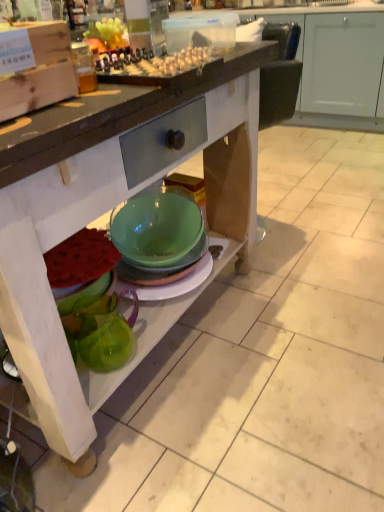
This screenshot has width=384, height=512. What do you see at coordinates (101, 332) in the screenshot?
I see `green glass pitcher at lower left` at bounding box center [101, 332].

What do you see at coordinates (112, 208) in the screenshot? The image size is (384, 512). I see `green glass bowl at lower center` at bounding box center [112, 208].

Where is `green glass bowl at lower center`? The width and height of the screenshot is (384, 512). green glass bowl at lower center is located at coordinates (112, 208).

Describe the element at coordinates (157, 64) in the screenshot. The image size is (384, 512). I see `translucent plastic container at upper center` at that location.

This screenshot has width=384, height=512. I want to click on green glass pitcher at lower left, so click(101, 332).

Considering the sizes of objects green glass pitcher at lower left and translucent plastic container at upper center in the image provided, who is bigger, green glass pitcher at lower left or translucent plastic container at upper center?

translucent plastic container at upper center.

Is point (115, 348) closer or farther from the camera than point (197, 55)?

Point (115, 348) appears to be farther away from the viewer than point (197, 55).

Is green glass pitcher at lower left positioned behind translucent plastic container at upper center?

Yes, green glass pitcher at lower left is behind translucent plastic container at upper center.

Is green glass bowl at lower center facing away from matte wood cabinet at upper center?

Yes, green glass bowl at lower center's orientation is away from matte wood cabinet at upper center.

From the image's perspective, between green glass bowl at lower center and matte wood cabinet at upper center, who is located below?

green glass bowl at lower center is shown below in the image.

Is green glass bowl at lower center surrounding matte wood cabinet at upper center?

Absolutely, matte wood cabinet at upper center is inside green glass bowl at lower center.

From a real-world perspective, is green glass bowl at lower center over matte wood cabinet at upper center?

Yes, from a real-world perspective, green glass bowl at lower center is on top of matte wood cabinet at upper center.

Consider the image. From the image's perspective, is green glass bowl at lower center on top of green glass pitcher at lower left?

Indeed, from the image's perspective, green glass bowl at lower center is shown above green glass pitcher at lower left.

Which is in front, point (195, 103) or point (121, 362)?

The point (195, 103) is closer to the camera.

Which object is positioned more to the left, green glass bowl at lower center or green glass pitcher at lower left?

green glass pitcher at lower left is more to the left.

The height and width of the screenshot is (512, 384). I want to click on table in front of the green glass pitcher at lower left, so click(x=112, y=208).

Is green glass pitcher at lower left facing away from matte wood cabinet at upper center?

No, green glass pitcher at lower left is not facing away from matte wood cabinet at upper center.

Is matte wood cabinet at upper center inside green glass pitcher at lower left?

No, matte wood cabinet at upper center is not inside green glass pitcher at lower left.

How many degrees apart are the facing directions of green glass pitcher at lower left and matte wood cabinet at upper center?

The angle between the facing direction of green glass pitcher at lower left and the facing direction of matte wood cabinet at upper center is 177 degrees.

Where is `cabinetry above the green glass pitcher at lower left (from the image's perspective)`? cabinetry above the green glass pitcher at lower left (from the image's perspective) is located at coordinates (336, 63).

Find the location of `tableware that is below the translucent plastic container at upper center (from the image's perspective)`. tableware that is below the translucent plastic container at upper center (from the image's perspective) is located at coordinates (101, 332).

Considering the positions of objects translucent plastic container at upper center and green glass pitcher at lower left in the image provided, who is more to the right, translucent plastic container at upper center or green glass pitcher at lower left?

Positioned to the right is translucent plastic container at upper center.

Could you tell me if translucent plastic container at upper center is turned towards green glass pitcher at lower left?

No, translucent plastic container at upper center does not turn towards green glass pitcher at lower left.

Is matte wood cabinet at upper center placed right next to green glass bowl at lower center?

They are not placed beside each other.

Looking at this image, from the image's perspective, is matte wood cabinet at upper center positioned above or below green glass bowl at lower center?

From the image's perspective, matte wood cabinet at upper center appears above green glass bowl at lower center.

Does matte wood cabinet at upper center have a lesser height compared to green glass bowl at lower center?

Yes.

Which object is positioned more to the left, matte wood cabinet at upper center or green glass bowl at lower center?

From the viewer's perspective, green glass bowl at lower center appears more on the left side.

From a real-world perspective, is translucent plastic container at upper center under matte wood cabinet at upper center?

Actually, translucent plastic container at upper center is physically above matte wood cabinet at upper center in the real world.

Is translucent plastic container at upper center further to camera compared to matte wood cabinet at upper center?

No, it is in front of matte wood cabinet at upper center.

Is translucent plastic container at upper center in contact with matte wood cabinet at upper center?

translucent plastic container at upper center is not next to matte wood cabinet at upper center, and they're not touching.

Can you confirm if translucent plastic container at upper center is positioned to the right of matte wood cabinet at upper center?

In fact, translucent plastic container at upper center is to the left of matte wood cabinet at upper center.

Identify the location of tableware on the left side of translucent plastic container at upper center. This screenshot has height=512, width=384. (101, 332).

Identify the location of cabinetry on the right of green glass bowl at lower center. The image size is (384, 512). (336, 63).

Which object lies further to the anchor point matte wood cabinet at upper center, green glass bowl at lower center or green glass pitcher at lower left?

green glass pitcher at lower left.

Based on their spatial positions, is translucent plastic container at upper center or green glass pitcher at lower left further from green glass bowl at lower center?

translucent plastic container at upper center is further to green glass bowl at lower center.

From the image, which object appears to be nearer to green glass pitcher at lower left, translucent plastic container at upper center or green glass bowl at lower center?

Based on the image, green glass bowl at lower center appears to be nearer to green glass pitcher at lower left.

Looking at the image, which one is located further to translucent plastic container at upper center, green glass bowl at lower center or matte wood cabinet at upper center?

The object further to translucent plastic container at upper center is matte wood cabinet at upper center.

Estimate the real-world distances between objects in this image. Which object is further from green glass pitcher at lower left, green glass bowl at lower center or matte wood cabinet at upper center?

matte wood cabinet at upper center lies further to green glass pitcher at lower left than the other object.

From the image, which object appears to be nearer to matte wood cabinet at upper center, green glass pitcher at lower left or translucent plastic container at upper center?

translucent plastic container at upper center.

Considering their positions, is green glass pitcher at lower left positioned further to green glass bowl at lower center than matte wood cabinet at upper center?

Among the two, matte wood cabinet at upper center is located further to green glass bowl at lower center.

Considering their positions, is green glass bowl at lower center positioned further to green glass pitcher at lower left than translucent plastic container at upper center?

Based on the image, translucent plastic container at upper center appears to be further to green glass pitcher at lower left.

You are a GUI agent. You are given a task and a screenshot of the screen. Output one action in this format:
    pyautogui.click(x=<x>, y=<y>)
    Task: Click on the tableware positioned between green glass bowl at lower center and matte wood cabinet at upper center from near to far
    The image size is (384, 512).
    Given the screenshot: What is the action you would take?
    pyautogui.click(x=101, y=332)

Identify the location of tableware between translucent plastic container at upper center and matte wood cabinet at upper center along the z-axis. The image size is (384, 512). (101, 332).

At what (x,y) coordinates should I click in order to perform the action: click on food between green glass bowl at lower center and green glass pitcher at lower left in the vertical direction. Please return your answer as a coordinate pair (x, y). Image resolution: width=384 pixels, height=512 pixels. Looking at the image, I should click on (157, 64).

The height and width of the screenshot is (512, 384). I want to click on food located between green glass bowl at lower center and matte wood cabinet at upper center in the depth direction, so click(x=157, y=64).